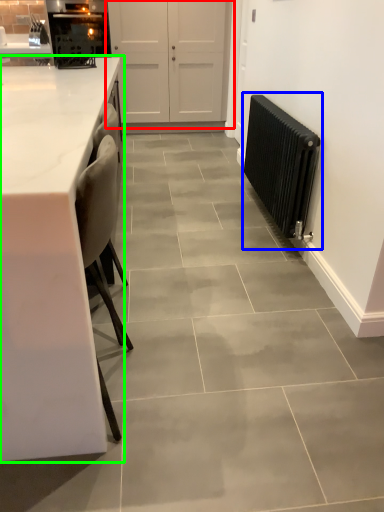
Question: Which is nearer to the door (highlighted by a red box)? radiator (highlighted by a blue box) or countertop (highlighted by a green box).

Choices:
 (A) radiator
 (B) countertop

Answer: (A)